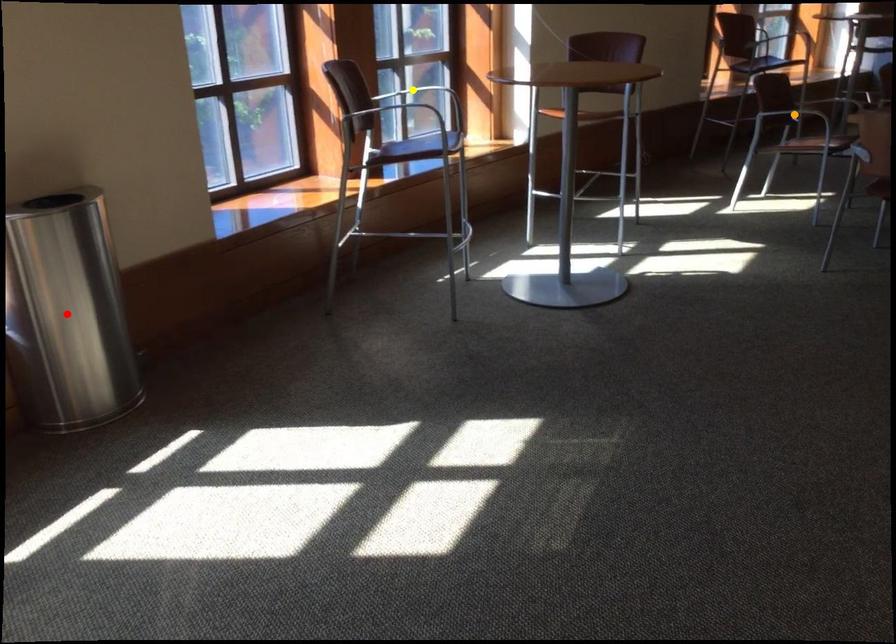
Order these from nearest to farthest:
- orange point
- yellow point
- red point

orange point, yellow point, red point